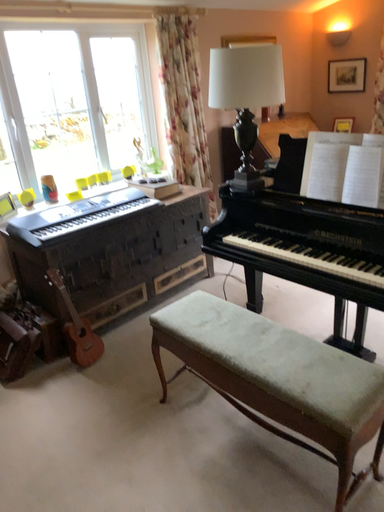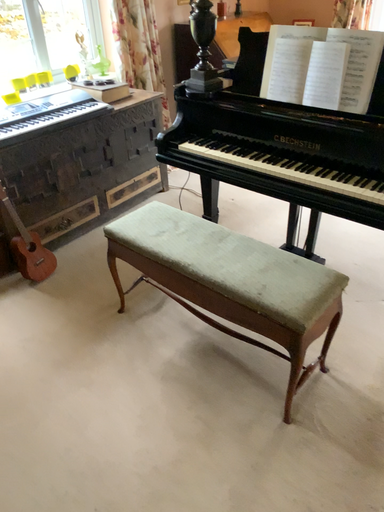
Question: Which way did the camera rotate in the video?

Choices:
 (A) rotated upward
 (B) rotated downward

Answer: (B)